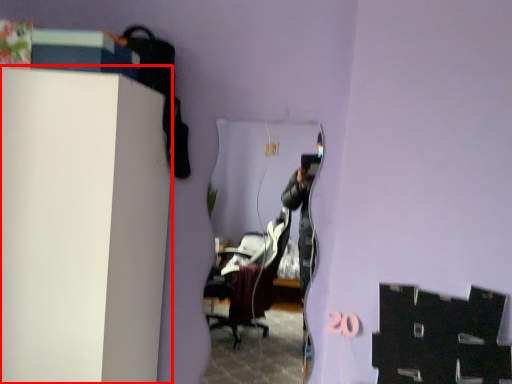
Question: Considering the relative positions of furniture (annotated by the red box) and mirror in the image provided, where is furniture (annotated by the red box) located with respect to the staircase?

Choices:
 (A) right
 (B) left

Answer: (B)